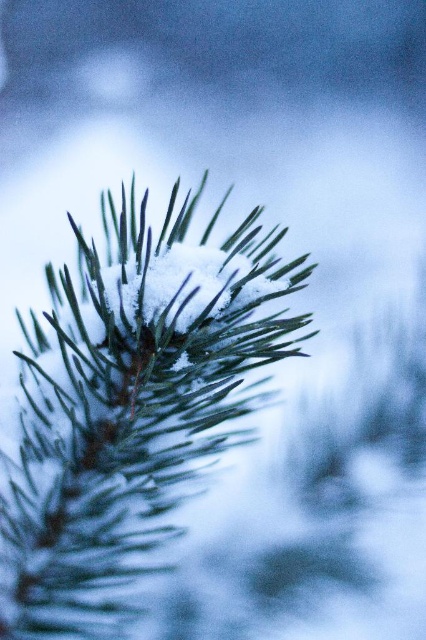
Looking at this image, between green matte fir tree at center and white fluffy snow at center, which one is positioned lower?

green matte fir tree at center is below.

Can you confirm if green matte fir tree at center is positioned below white fluffy snow at center?

Yes.

Is point (86, 531) positioned behind point (213, 284)?

Yes, it is behind point (213, 284).

I want to click on green matte fir tree at center, so click(x=129, y=406).